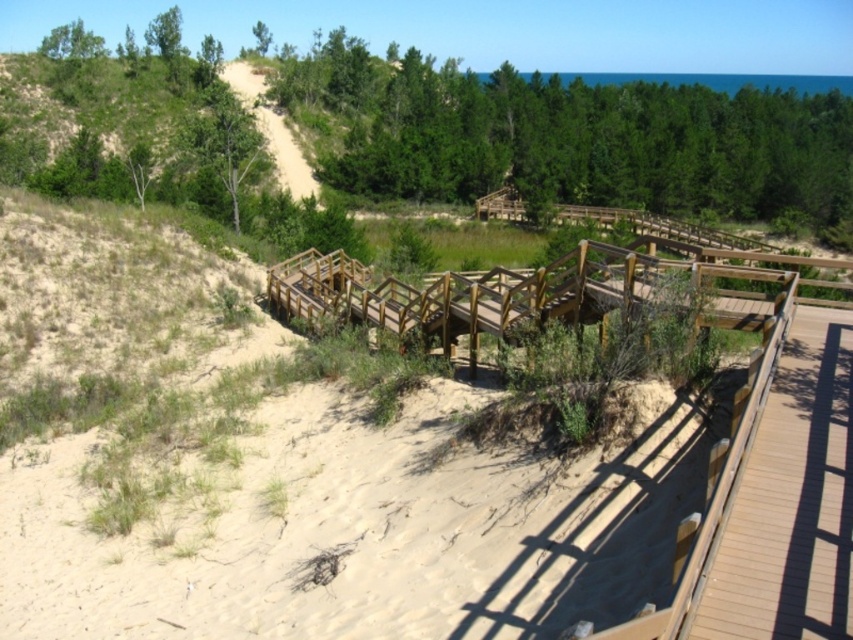
Based on the photo, you are a hiker planning to climb the dune. You see the wooden stairs at center and the smooth sand path at upper left. Which path is higher up the dune?

The smooth sand path at upper left is higher up the dune than the wooden stairs at center.

You are planning to walk from the light brown sandy path at center to the brown wood boardwalk at right. Given that your average walking speed is 3 feet per second, how many seconds will it take you to reach the boardwalk?

The distance between the light brown sandy path at center and the brown wood boardwalk at right is 39.58 feet. At a speed of 3 feet per second, dividing the distance by speed gives approximately 13.19 seconds. So it will take roughly 13 seconds to reach the boardwalk.

You are a hiker planning to climb the dune. You see the brown wood boardwalk at right and the wooden stairs at center. Which structure should you use to reach the top of the dune?

The wooden stairs at center are located above the brown wood boardwalk at right, so you should use the wooden stairs at center to reach the top of the dune.